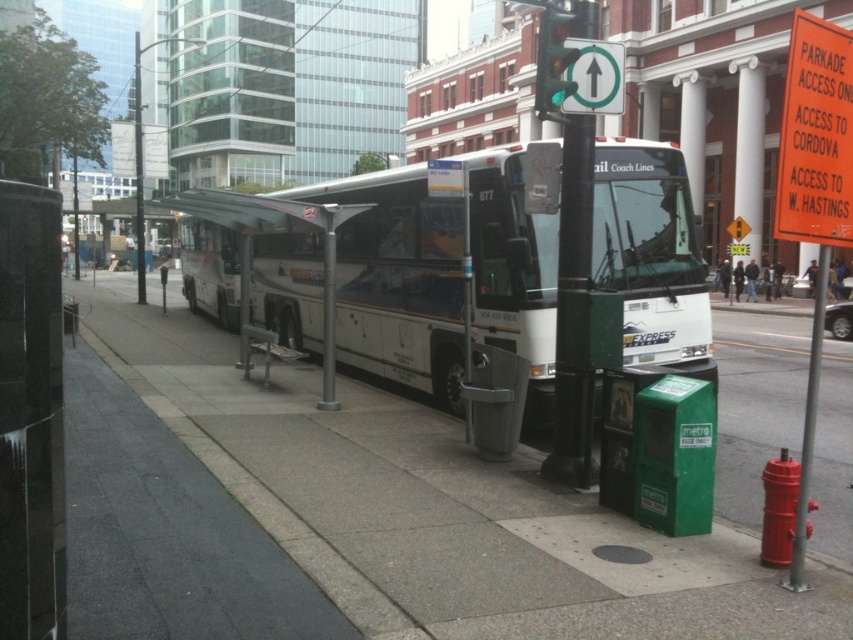
You are a delivery person who needs to park your 6.5 meter long delivery van. You see the white glossy bus at center and the metallic green traffic light at upper center. Is there enough space between them to park your van?

The white glossy bus at center is 7.14 meters away from the metallic green traffic light at upper center. Since the van is 6.5 meters long, there is enough space between them to park the van.

You are a pedestrian standing at the bus stop and want to reach the metallic pole at lower right and the green plastic sign at upper center. Which object is closer to you?

The metallic pole at lower right is closer to the viewer than the green plastic sign at upper center.